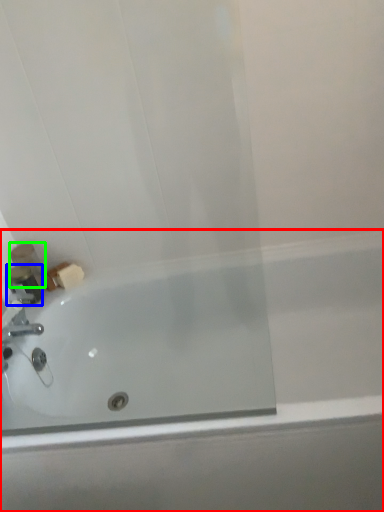
Question: Based on their relative distances, which object is nearer to bathtub (highlighted by a red box)? Choose from toiletry (highlighted by a blue box) and toiletry (highlighted by a green box).

Choices:
 (A) toiletry
 (B) toiletry

Answer: (A)